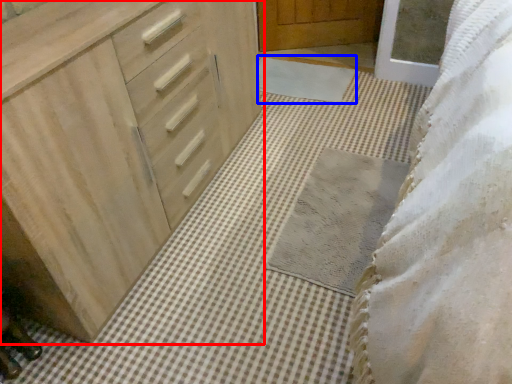
Question: Which object appears farthest to the camera in this image, chest of drawers (highlighted by a red box) or bath mat (highlighted by a blue box)?

Choices:
 (A) chest of drawers
 (B) bath mat

Answer: (B)